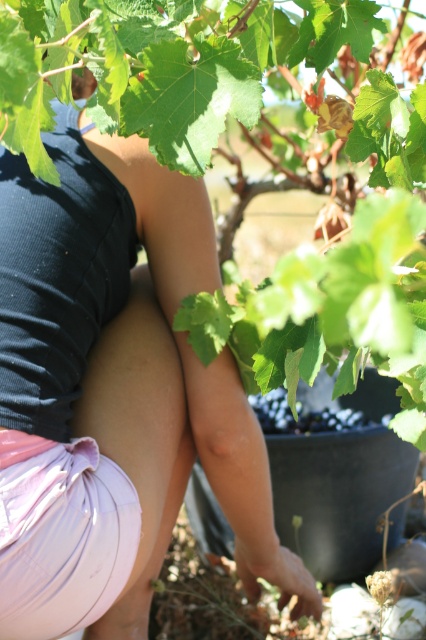
You are a gardener who needs to place a small decoration between the pink fabric at lower left and the black matte grape at center. Which object should you place the decoration closer to to ensure it fits within the available space?

The black matte grape at center is smaller than the pink fabric at lower left, so placing the decoration closer to the black matte grape at center would ensure it fits within the available space.

You are a drone operator trying to capture a close shot of the gardener. You need to adjust your camera to focus on two points in the image, point 1 at point (88, 372) and point 2 at point (270, 401). Which point should you focus on first if you want to start with the closer one?

Point 1 at point (88, 372) is closer to the viewer than point 2 at point (270, 401), so you should focus on point 1 first.